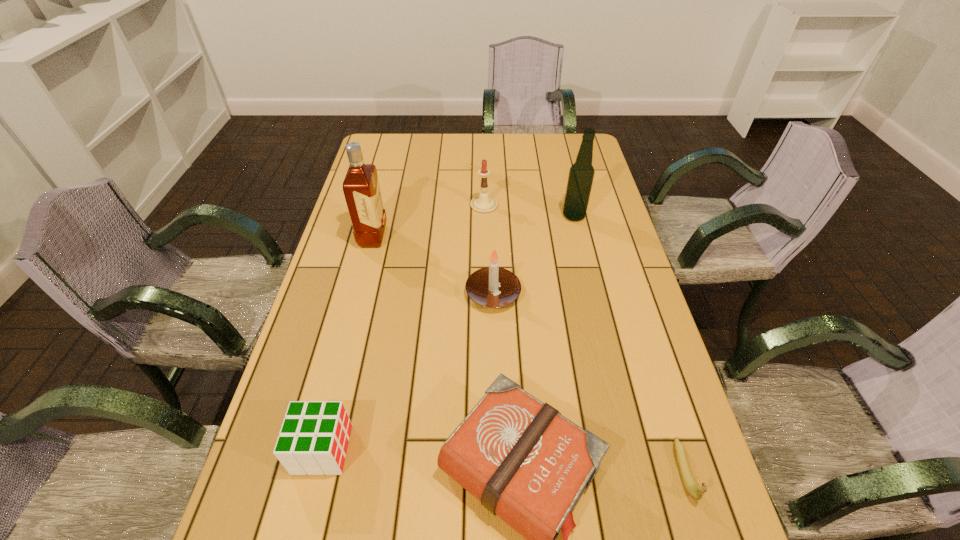
At what (x,y) coordinates should I click in order to perform the action: click on vacant space that satisfies the following two spatial constraints: 1. on the front label of the fourth nearest object; 2. on the left side of the liquor. Please return your answer as a coordinate pair (x, y). Looking at the image, I should click on (358, 293).

The image size is (960, 540). What are the coordinates of `vacant space that satisfies the following two spatial constraints: 1. on the front side of the alcohol; 2. on the front label of the liquor` in the screenshot? It's located at (579, 237).